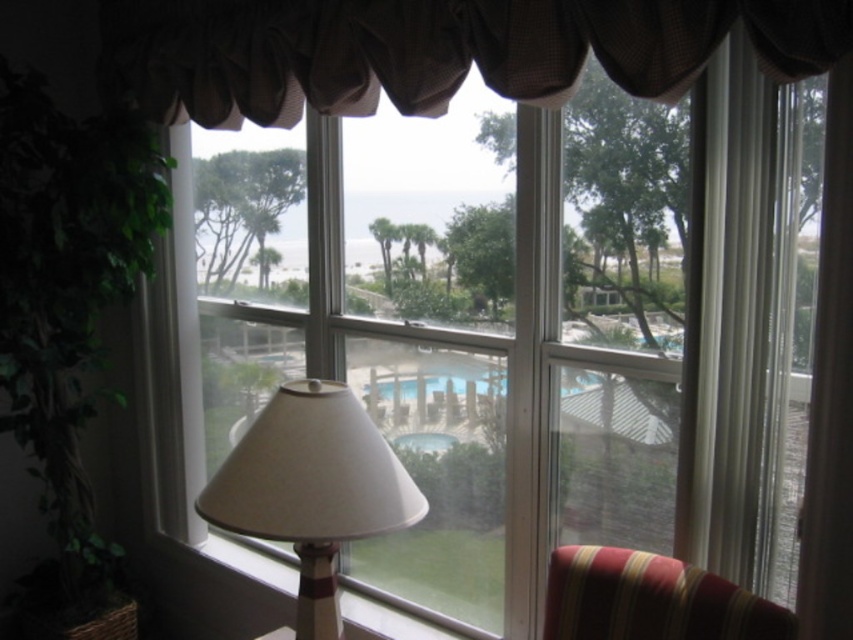
Based on the photo, you are standing inside the room looking out the window. You see a point marked at coordinates (x=651, y=600). What object is located at that point?

The point at coordinates (x=651, y=600) marks the striped fabric armchair at lower right.

You are sitting in the striped fabric armchair at lower right and want to look at the transparent glass pool at center. Which direction should you turn your head to see it?

You should turn your head to the left because the striped fabric armchair at lower right is in front of the transparent glass pool at center, so the pool would be to your left side.